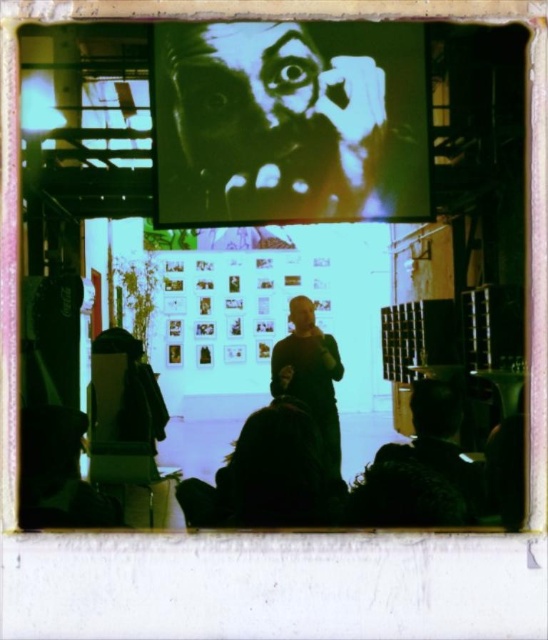
You are an attendee at the event and want to take a photo of the speaker. The high contrast face at center and the dark brown leather jacket at center are both in your camera frame. Which object should you focus on to capture the speaker clearly?

The high contrast face at center is above the dark brown leather jacket at center, so focusing on the high contrast face at center will ensure the speaker is captured clearly as it is the upper part of the speaker.

You are an attendee at this event and want to take a photo of the speaker. The speaker is wearing a dark brown leather jacket at center and there is a high contrast face at center on the screen. Where should you aim your camera to capture both the speaker and the face on the screen?

To capture both the speaker wearing the dark brown leather jacket at center and the high contrast face at center on the screen, aim your camera so that the high contrast face at center is on the left side of the dark brown leather jacket at center in the frame, as described.